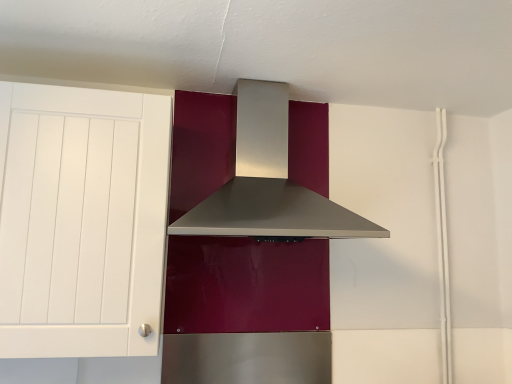
The height and width of the screenshot is (384, 512). In order to click on empty space that is ontop of satin silver range hood at center (from a real-world perspective) in this screenshot , I will do `click(273, 66)`.